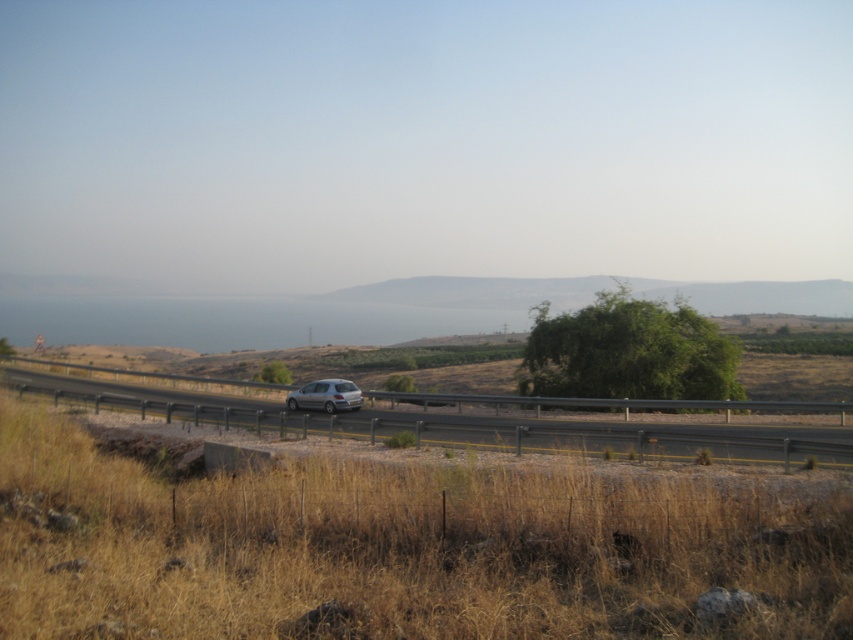
Question: Which object is the farthest from the dry grass at center?

Choices:
 (A) satin silver hatchback at center
 (B) metallic gray highway at center

Answer: (A)

Question: Does dry grass at center have a larger size compared to metallic gray highway at center?

Choices:
 (A) yes
 (B) no

Answer: (B)

Question: Among these objects, which one is nearest to the camera?

Choices:
 (A) satin silver hatchback at center
 (B) dry grass at center

Answer: (B)

Question: Is dry grass at center thinner than metallic gray highway at center?

Choices:
 (A) yes
 (B) no

Answer: (A)

Question: Among these points, which one is farthest from the camera?

Choices:
 (A) (415, 445)
 (B) (325, 401)
 (C) (727, 577)

Answer: (B)

Question: Considering the relative positions of metallic gray highway at center and satin silver hatchback at center in the image provided, where is metallic gray highway at center located with respect to satin silver hatchback at center?

Choices:
 (A) right
 (B) left

Answer: (B)